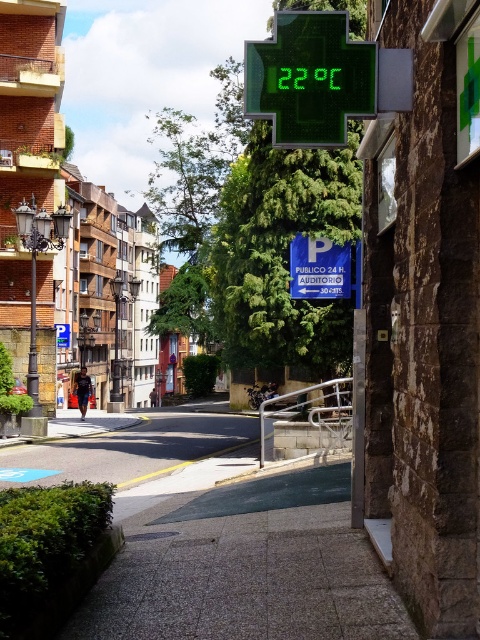
You are standing at the edge of the gray concrete pavement at lower center and want to throw a ball to a friend who is standing 5 meters away from you. Can you reach them with your throw?

The distance between you and your friend is 5 meters, but the gray concrete pavement at lower center is only 4.40 meters away from the camera. Therefore, you might not be able to reach them with a single throw unless you move closer.

You are a delivery person trying to park your van on the gray concrete pavement at lower center. However, there is a white plastic parking sign at center above it. Can you park there without violating any parking restrictions?

The gray concrete pavement at lower center is positioned under the white plastic parking sign at center. Since the parking sign is likely indicating restrictions, you should not park there without checking the sign first.

You are a delivery person standing on the gray concrete pavement at lower center and need to place a package on the white plastic parking sign at center. Can you reach the sign without moving from your current position?

The gray concrete pavement at lower center and white plastic parking sign at center are 8.81 meters apart from each other, so you cannot reach the sign without moving from your current position as the distance is too far.